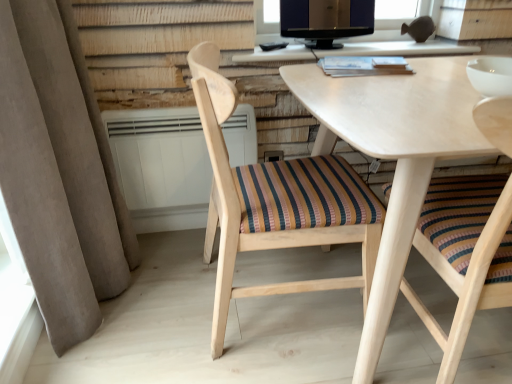
Question: Is wooden chair with striped cushion at center, which is the first chair in right-to-left order, wider or thinner than matte black monitor at upper center?

Choices:
 (A) thin
 (B) wide

Answer: (B)

Question: From the image's perspective, is wooden chair with striped cushion at center, which is the first chair in right-to-left order, above or below matte black monitor at upper center?

Choices:
 (A) above
 (B) below

Answer: (B)

Question: Estimate the real-world distances between objects in this image. Which object is farther from the white plastic radiator at center?

Choices:
 (A) beige fabric curtain at left
 (B) light wood table at upper center
 (C) wooden chair with striped cushion at center, positioned as the first chair in left-to-right order
 (D) wooden chair with striped cushion at center, which is the first chair in right-to-left order
 (E) matte black monitor at upper center

Answer: (D)

Question: Estimate the real-world distances between objects in this image. Which object is farther from the matte black monitor at upper center?

Choices:
 (A) light wood table at upper center
 (B) wooden chair with striped cushion at center, the 2th chair viewed from the right
 (C) white plastic radiator at center
 (D) beige fabric curtain at left
 (E) wooden chair with striped cushion at center, which is the first chair in right-to-left order

Answer: (D)